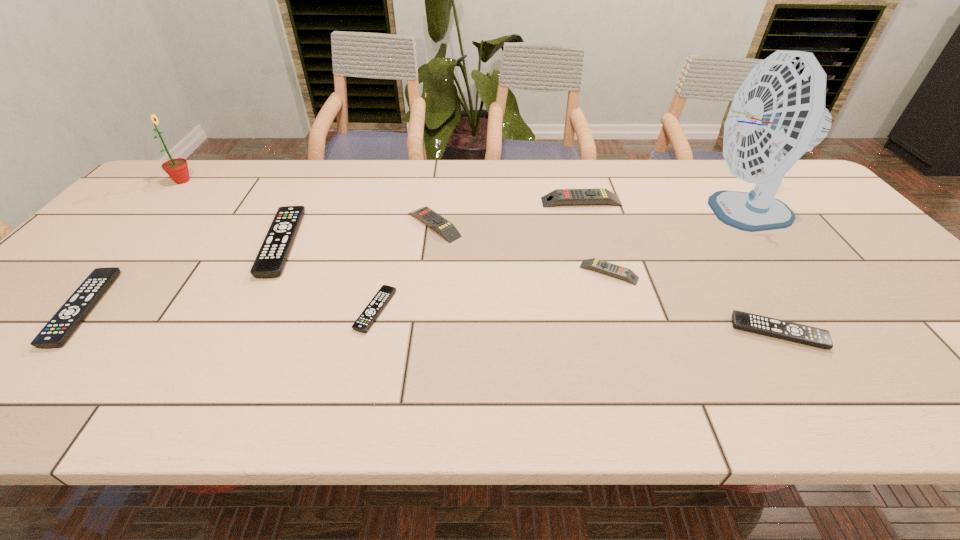
Locate an element on the screen. This screenshot has height=540, width=960. free spot between the nearest yellow remote control and the seventh object from right to left is located at coordinates pos(445,258).

Find the location of a particular element. This screenshot has height=540, width=960. unoccupied area between the second biggest black remote control and the biggest yellow remote control is located at coordinates (332, 255).

This screenshot has height=540, width=960. What are the coordinates of `vacant area between the third biggest black remote control and the leftmost remote control` in the screenshot? It's located at (431, 320).

This screenshot has width=960, height=540. Find the location of `empty space between the green sunflower and the third smallest black remote control`. empty space between the green sunflower and the third smallest black remote control is located at coordinates (133, 245).

Identify the location of free area in between the leftmost yellow remote control and the farthest yellow remote control. The image size is (960, 540). (508, 213).

Where is `free space between the nearest yellow remote control and the tallest object`? free space between the nearest yellow remote control and the tallest object is located at coordinates (673, 242).

Locate an element on the screen. Image resolution: width=960 pixels, height=540 pixels. unoccupied position between the biggest yellow remote control and the tallest object is located at coordinates (659, 207).

Find the location of a particular element. free spot between the third black remote control from left to right and the leftmost remote control is located at coordinates (229, 309).

This screenshot has width=960, height=540. What are the coordinates of `empty location between the smallest yellow remote control and the rightmost remote control` in the screenshot? It's located at (693, 302).

This screenshot has width=960, height=540. I want to click on object that ranks as the second closest to the rightmost black remote control, so click(x=778, y=113).